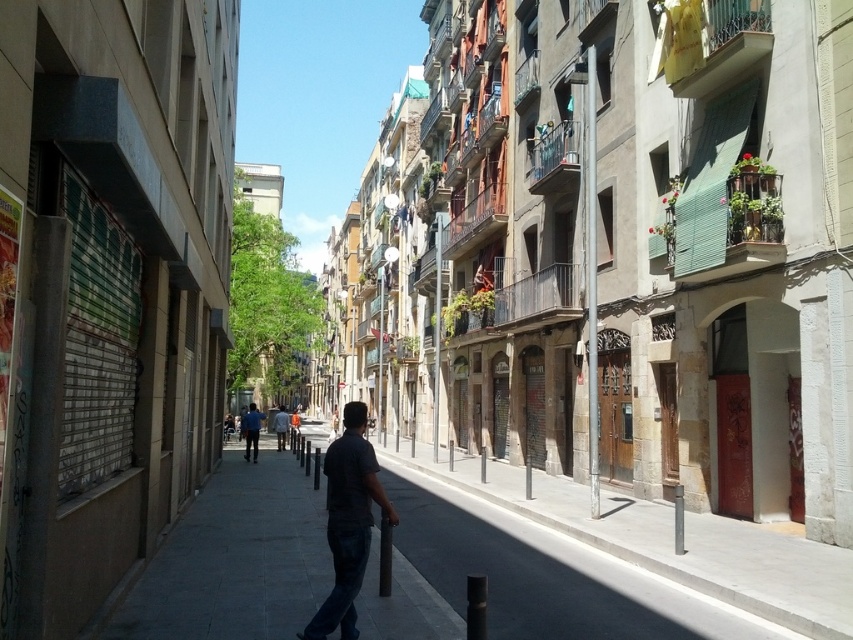
Who is positioned more to the left, smooth concrete sidewalk at center or dark gray shirt at center?

dark gray shirt at center

Does point (462, 461) come behind point (352, 490)?

Yes, point (462, 461) is behind point (352, 490).

This screenshot has width=853, height=640. What are the coordinates of `smooth concrete sidewalk at center` in the screenshot? It's located at (672, 541).